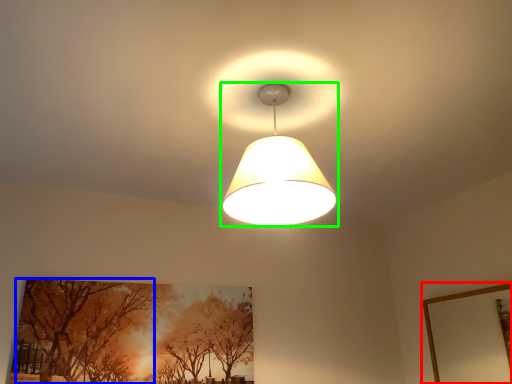
Question: Which is farther away from picture frame (highlighted by a red box)? tree (highlighted by a blue box) or lamp (highlighted by a green box)?

Choices:
 (A) tree
 (B) lamp

Answer: (A)